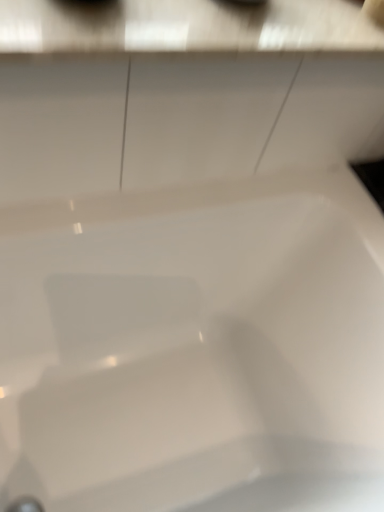
Question: Should I look upward or downward to see white glossy bathtub at center?

Choices:
 (A) down
 (B) up

Answer: (A)